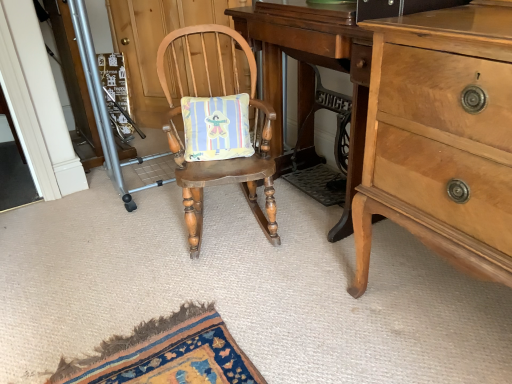
Where is `vacant area in front of light brown wood changing table at center`? This screenshot has height=384, width=512. vacant area in front of light brown wood changing table at center is located at coordinates (285, 299).